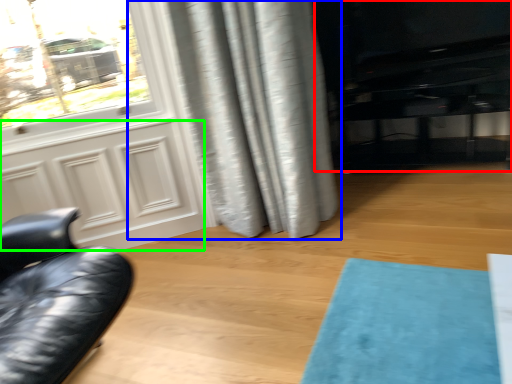
Question: Which object is positioned farthest from entertainment center (highlighted by a red box)? Select from curtain (highlighted by a blue box) and screen door (highlighted by a green box).

Choices:
 (A) curtain
 (B) screen door

Answer: (B)